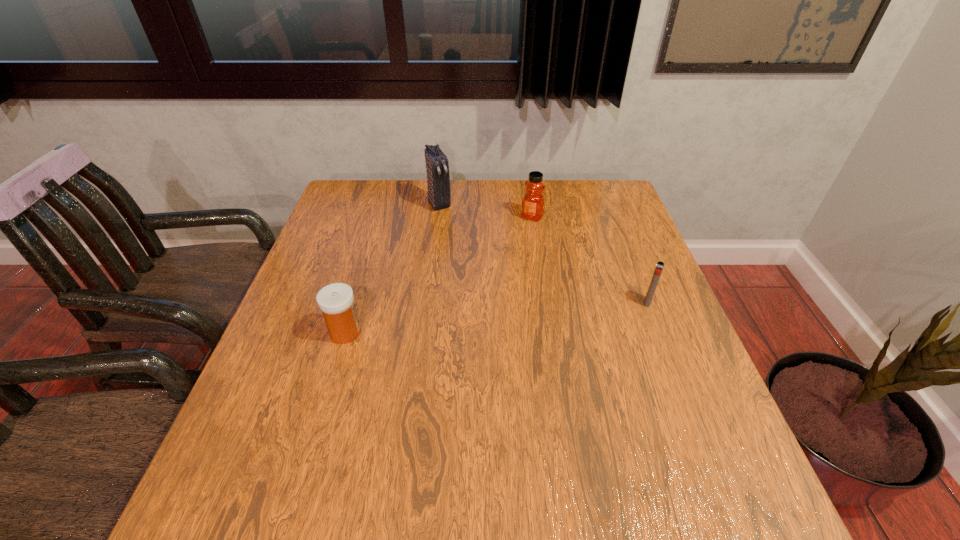
Image resolution: width=960 pixels, height=540 pixels. What are the coordinates of `vacant space located with the zip open on the clutch bag` in the screenshot? It's located at (x=493, y=291).

You are a GUI agent. You are given a task and a screenshot of the screen. Output one action in this format:
    pyautogui.click(x=<x>, y=<y>)
    Task: Click on the free point located with the zip open on the clutch bag
    
    Given the screenshot: What is the action you would take?
    pos(488,281)

Image resolution: width=960 pixels, height=540 pixels. I want to click on vacant space located 0.260m with the zip open on the clutch bag, so click(475, 262).

Image resolution: width=960 pixels, height=540 pixels. I want to click on blank space located on the front label of the third shortest object, so click(x=470, y=303).

The width and height of the screenshot is (960, 540). In order to click on vacant space located 0.150m on the front label of the third shortest object in this screenshot , I will do `click(508, 250)`.

The width and height of the screenshot is (960, 540). Identify the location of vacant area located 0.350m on the front label of the third shortest object. (476, 295).

In order to click on clutch bag at the far edge in this screenshot , I will do `click(438, 179)`.

Identify the location of honey present at the far edge. (533, 201).

Where is `object that is at the left edge`? Image resolution: width=960 pixels, height=540 pixels. object that is at the left edge is located at coordinates (336, 300).

Locate an element on the screen. The image size is (960, 540). object located at the right edge is located at coordinates (659, 267).